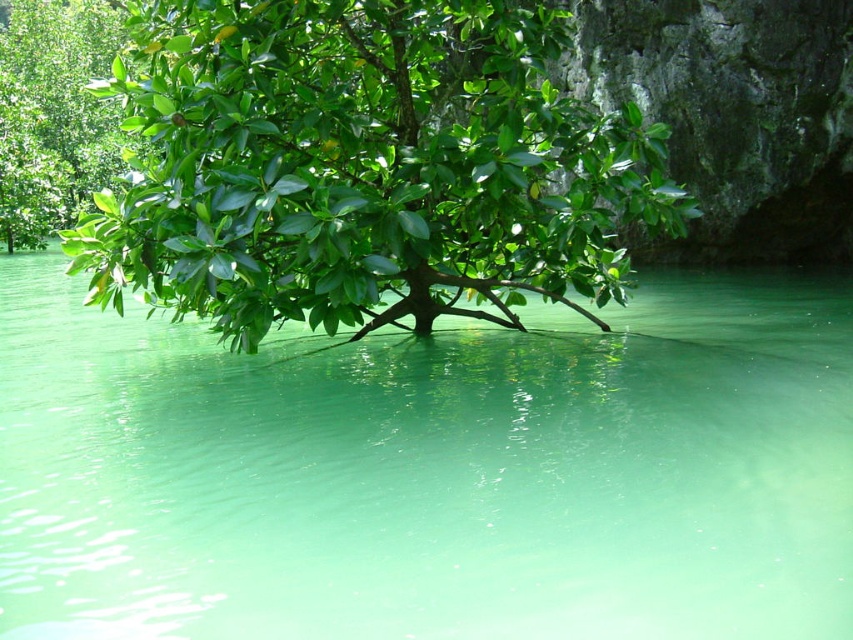
Can you confirm if green translucent water at center is taller than green leafy tree at upper left?

In fact, green translucent water at center may be shorter than green leafy tree at upper left.

Is point (699, 595) positioned in front of point (38, 33)?

Yes, point (699, 595) is closer to viewer.

At what (x,y) coordinates should I click in order to perform the action: click on green translucent water at center. Please return your answer as a coordinate pair (x, y). This screenshot has height=640, width=853. Looking at the image, I should click on (431, 472).

Who is more distant from viewer, (68, 616) or (625, 136)?

The point (625, 136) is more distant.

Does green translucent water at center appear under green glossy tree at center?

Indeed, green translucent water at center is positioned under green glossy tree at center.

Is point (469, 385) more distant than point (457, 164)?

That is True.

The image size is (853, 640). Identify the location of green translucent water at center. (431, 472).

Who is higher up, green glossy tree at center or green leafy tree at upper left?

Positioned higher is green leafy tree at upper left.

Does green glossy tree at center have a greater width compared to green leafy tree at upper left?

No, green glossy tree at center is not wider than green leafy tree at upper left.

Locate an element on the screen. The height and width of the screenshot is (640, 853). green glossy tree at center is located at coordinates (363, 168).

Image resolution: width=853 pixels, height=640 pixels. Find the location of `green glossy tree at center`. green glossy tree at center is located at coordinates (363, 168).